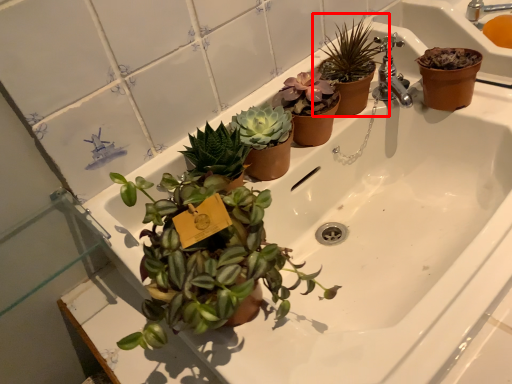
Question: From the image's perspective, what is the correct spatial relationship of houseplant (annotated by the red box) in relation to sink?

Choices:
 (A) below
 (B) above

Answer: (A)